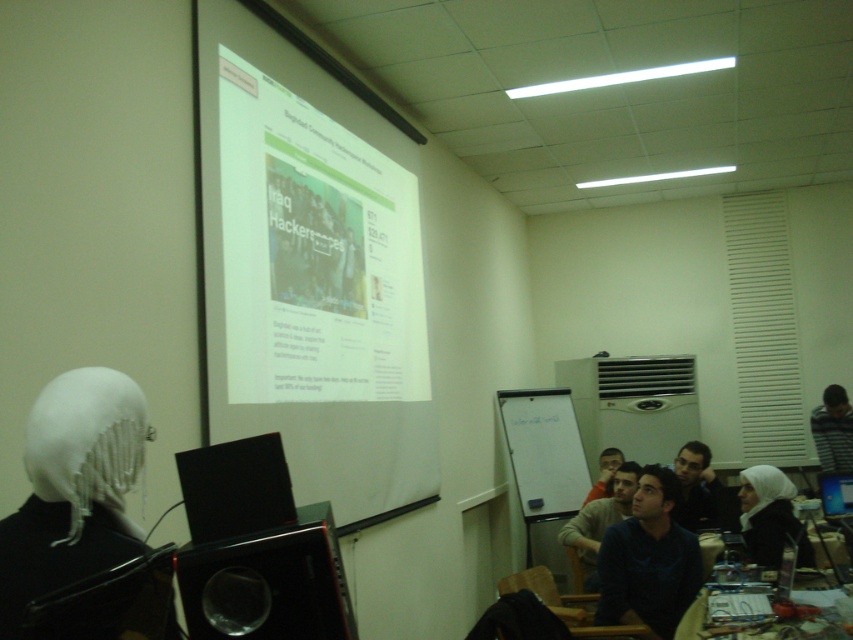
Who is shorter, black matte computer screen at lower left or striped sweater at right?

With less height is black matte computer screen at lower left.

Between black matte computer screen at lower left and striped sweater at right, which one appears on the left side from the viewer's perspective?

From the viewer's perspective, black matte computer screen at lower left appears more on the left side.

Where is `black matte computer screen at lower left`? black matte computer screen at lower left is located at coordinates (235, 486).

What are the coordinates of `black matte computer screen at lower left` in the screenshot? It's located at (235, 486).

Is dark blue shirt at center to the right of matte black laptop at center from the viewer's perspective?

No, dark blue shirt at center is not to the right of matte black laptop at center.

You are a GUI agent. You are given a task and a screenshot of the screen. Output one action in this format:
    pyautogui.click(x=<x>, y=<y>)
    Task: Click on the dark blue shirt at center
    
    Given the screenshot: What is the action you would take?
    pyautogui.click(x=648, y=560)

Find the location of a particular element. dark blue shirt at center is located at coordinates (648, 560).

Is point (67, 492) positioned before point (830, 390)?

Yes, it is in front of point (830, 390).

Between point (109, 492) and point (830, 413), which one is positioned behind?

The point (830, 413) is more distant.

Locate an element on the screen. This screenshot has width=853, height=640. white matte headscarf at left is located at coordinates (73, 488).